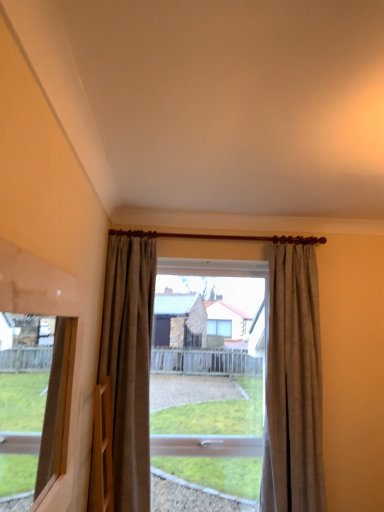
Question: Is matte brown curtain at center, arranged as the 1th curtain when viewed from the left, oriented towards wooden frame at left?

Choices:
 (A) no
 (B) yes

Answer: (B)

Question: Does matte brown curtain at center, positioned as the second curtain in right-to-left order, have a greater width compared to wooden frame at left?

Choices:
 (A) no
 (B) yes

Answer: (B)

Question: From the image's perspective, does matte brown curtain at center, positioned as the second curtain in right-to-left order, appear higher than wooden frame at left?

Choices:
 (A) no
 (B) yes

Answer: (A)

Question: Is matte brown curtain at center, positioned as the second curtain in right-to-left order, next to wooden frame at left and touching it?

Choices:
 (A) yes
 (B) no

Answer: (B)

Question: Considering the relative positions of matte brown curtain at center, positioned as the second curtain in right-to-left order, and wooden frame at left in the image provided, is matte brown curtain at center, positioned as the second curtain in right-to-left order, to the right of wooden frame at left from the viewer's perspective?

Choices:
 (A) no
 (B) yes

Answer: (B)

Question: Does matte brown curtain at center, positioned as the second curtain in right-to-left order, have a lesser width compared to wooden frame at left?

Choices:
 (A) no
 (B) yes

Answer: (A)

Question: Are wooden frame at left and beige textured curtain at center, which appears as the second curtain when viewed from the left, far apart?

Choices:
 (A) no
 (B) yes

Answer: (B)

Question: Is wooden frame at left at the right side of beige textured curtain at center, acting as the 1th curtain starting from the right?

Choices:
 (A) yes
 (B) no

Answer: (B)

Question: Is wooden frame at left taller than beige textured curtain at center, acting as the 1th curtain starting from the right?

Choices:
 (A) yes
 (B) no

Answer: (B)

Question: Is wooden frame at left completely or partially outside of beige textured curtain at center, acting as the 1th curtain starting from the right?

Choices:
 (A) no
 (B) yes

Answer: (B)

Question: Is wooden frame at left positioned before beige textured curtain at center, which appears as the second curtain when viewed from the left?

Choices:
 (A) yes
 (B) no

Answer: (A)

Question: Is beige textured curtain at center, which appears as the second curtain when viewed from the left, at the back of wooden frame at left?

Choices:
 (A) no
 (B) yes

Answer: (A)

Question: Is transparent glass window at center aimed at matte brown curtain at center, positioned as the second curtain in right-to-left order?

Choices:
 (A) yes
 (B) no

Answer: (B)